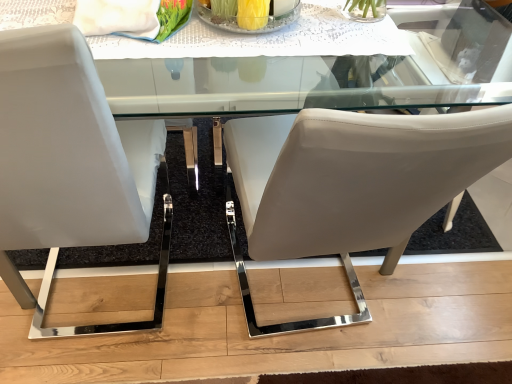
Question: Is the depth of matte white chair at center, positioned as the first chair in right-to-left order, greater than that of white leather chair at left, the first chair when ordered from left to right?

Choices:
 (A) no
 (B) yes

Answer: (A)

Question: Is matte white chair at center, positioned as the first chair in right-to-left order, shorter than white leather chair at left, placed as the 2th chair when sorted from right to left?

Choices:
 (A) yes
 (B) no

Answer: (B)

Question: Does matte white chair at center, positioned as the first chair in right-to-left order, turn towards white leather chair at left, the first chair when ordered from left to right?

Choices:
 (A) no
 (B) yes

Answer: (A)

Question: Does matte white chair at center, placed as the second chair when sorted from left to right, contain white leather chair at left, placed as the 2th chair when sorted from right to left?

Choices:
 (A) yes
 (B) no

Answer: (B)

Question: Can you confirm if matte white chair at center, placed as the second chair when sorted from left to right, is bigger than white leather chair at left, the first chair when ordered from left to right?

Choices:
 (A) yes
 (B) no

Answer: (A)

Question: Is matte white chair at center, placed as the second chair when sorted from left to right, with white leather chair at left, placed as the 2th chair when sorted from right to left?

Choices:
 (A) no
 (B) yes

Answer: (A)

Question: Is clear glass table at upper center to the right of matte white chair at center, placed as the second chair when sorted from left to right, from the viewer's perspective?

Choices:
 (A) no
 (B) yes

Answer: (A)

Question: From a real-world perspective, is clear glass table at upper center physically above matte white chair at center, placed as the second chair when sorted from left to right?

Choices:
 (A) no
 (B) yes

Answer: (B)

Question: Can you confirm if clear glass table at upper center is bigger than matte white chair at center, positioned as the first chair in right-to-left order?

Choices:
 (A) yes
 (B) no

Answer: (B)

Question: Is clear glass table at upper center outside matte white chair at center, positioned as the first chair in right-to-left order?

Choices:
 (A) yes
 (B) no

Answer: (B)

Question: Is clear glass table at upper center thinner than matte white chair at center, placed as the second chair when sorted from left to right?

Choices:
 (A) yes
 (B) no

Answer: (A)

Question: From a real-world perspective, is clear glass table at upper center located beneath matte white chair at center, placed as the second chair when sorted from left to right?

Choices:
 (A) no
 (B) yes

Answer: (A)

Question: Considering the relative positions of clear glass table at upper center and white leather chair at left, the first chair when ordered from left to right, in the image provided, is clear glass table at upper center to the left of white leather chair at left, the first chair when ordered from left to right, from the viewer's perspective?

Choices:
 (A) no
 (B) yes

Answer: (A)